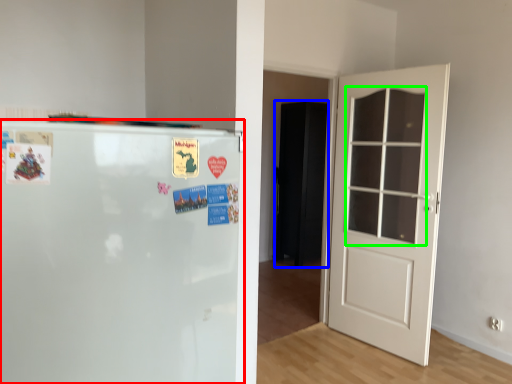
Question: Based on their relative distances, which object is nearer to refrigerator (highlighted by a red box)? Choose from armoire (highlighted by a blue box) and window (highlighted by a green box).

Choices:
 (A) armoire
 (B) window

Answer: (B)